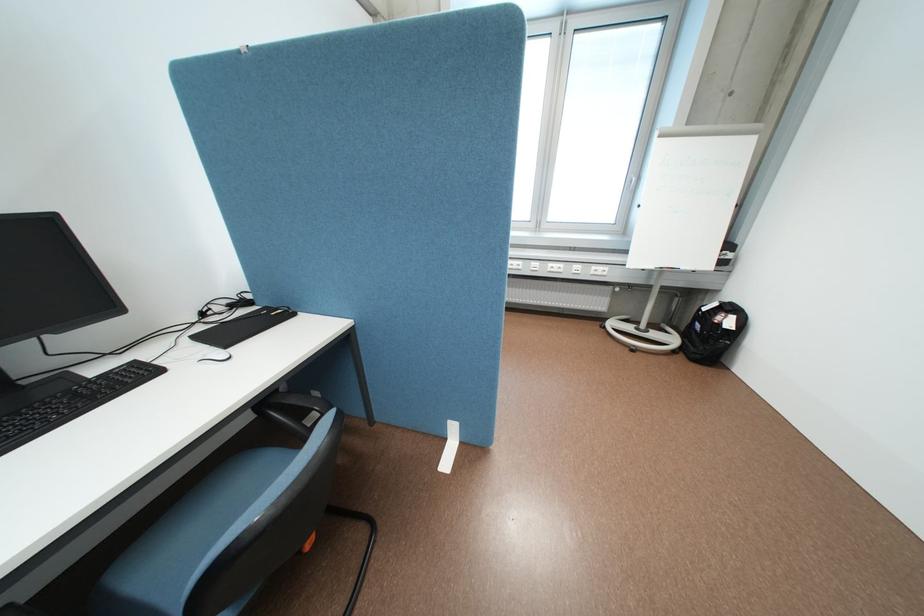
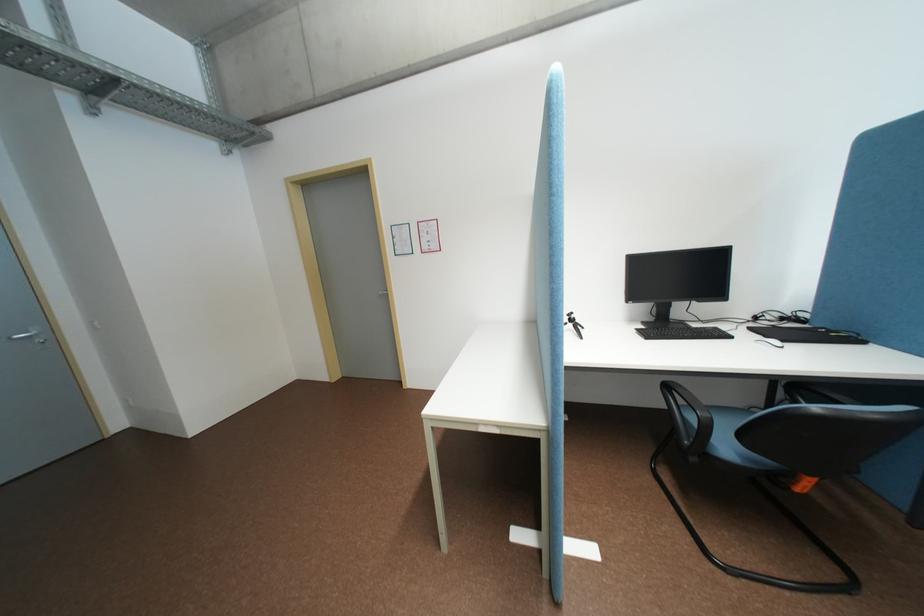
Question: The camera is either moving clockwise (left) or counter-clockwise (right) around the object. The first image is from the beginning of the video and the second image is from the end. Is the camera moving left or right when shooting the video?

Choices:
 (A) Left
 (B) Right

Answer: (B)